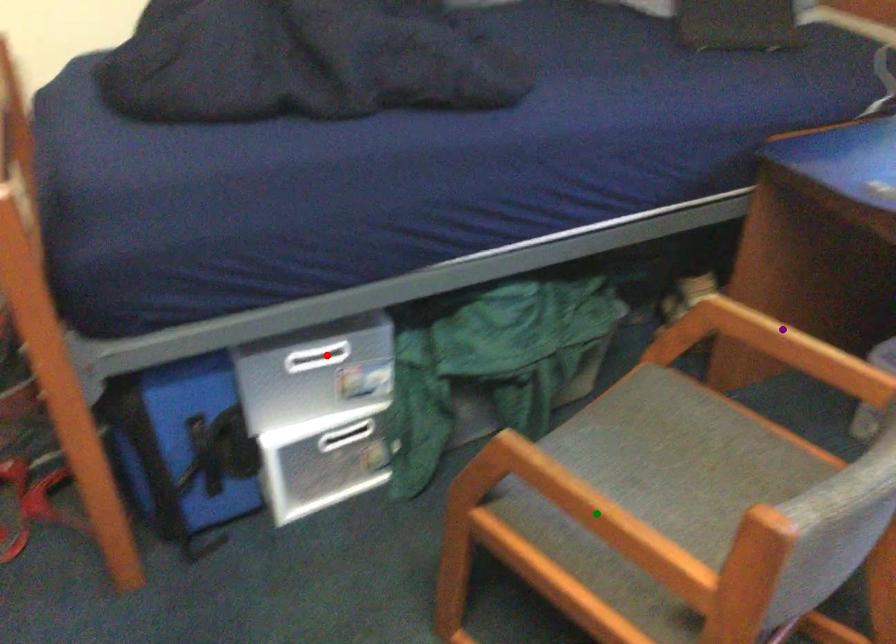
Order these from nearest to farthest:
1. purple point
2. green point
3. red point

green point → red point → purple point